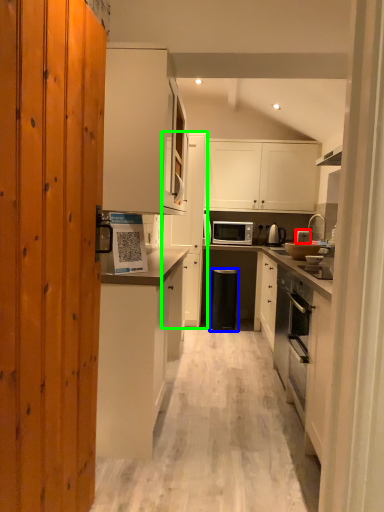
Question: Which object is the closest to the appliance (highlighted by a red box)? Choose among these: trash bin/can (highlighted by a blue box) or cabinetry (highlighted by a green box).

Choices:
 (A) trash bin/can
 (B) cabinetry

Answer: (A)